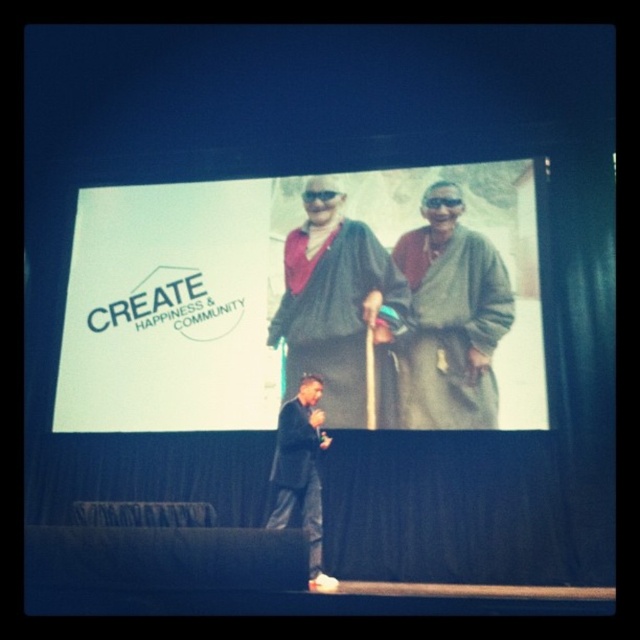
Does green woolen robe at center appear on the left side of dark green textured robe at center?

In fact, green woolen robe at center is to the right of dark green textured robe at center.

Based on the photo, between green woolen robe at center and dark green textured robe at center, which one appears on the left side from the viewer's perspective?

dark green textured robe at center is more to the left.

What do you see at coordinates (451, 328) in the screenshot?
I see `green woolen robe at center` at bounding box center [451, 328].

This screenshot has width=640, height=640. Find the location of `green woolen robe at center`. green woolen robe at center is located at coordinates (451, 328).

Between point (230, 314) and point (332, 248), which one is positioned in front?

Point (332, 248)

Does white paper at upper center appear on the left side of dark green textured robe at center?

Correct, you'll find white paper at upper center to the left of dark green textured robe at center.

Describe the element at coordinates (305, 301) in the screenshot. The width and height of the screenshot is (640, 640). I see `white paper at upper center` at that location.

You are a GUI agent. You are given a task and a screenshot of the screen. Output one action in this format:
    pyautogui.click(x=<x>, y=<y>)
    Task: Click on the white paper at upper center
    The width and height of the screenshot is (640, 640).
    Given the screenshot: What is the action you would take?
    (305, 301)

Is green woolen robe at center positioned behind dark gray woolen robe at center?

Yes, green woolen robe at center is behind dark gray woolen robe at center.

Who is more distant from viewer, (480, 272) or (317, 502)?

The point (480, 272) is more distant.

Which is behind, point (472, 266) or point (276, 515)?

The point (472, 266) is more distant.

You are a GUI agent. You are given a task and a screenshot of the screen. Output one action in this format:
    pyautogui.click(x=<x>, y=<y>)
    Task: Click on the green woolen robe at center
    The image size is (640, 640).
    Given the screenshot: What is the action you would take?
    pyautogui.click(x=451, y=328)